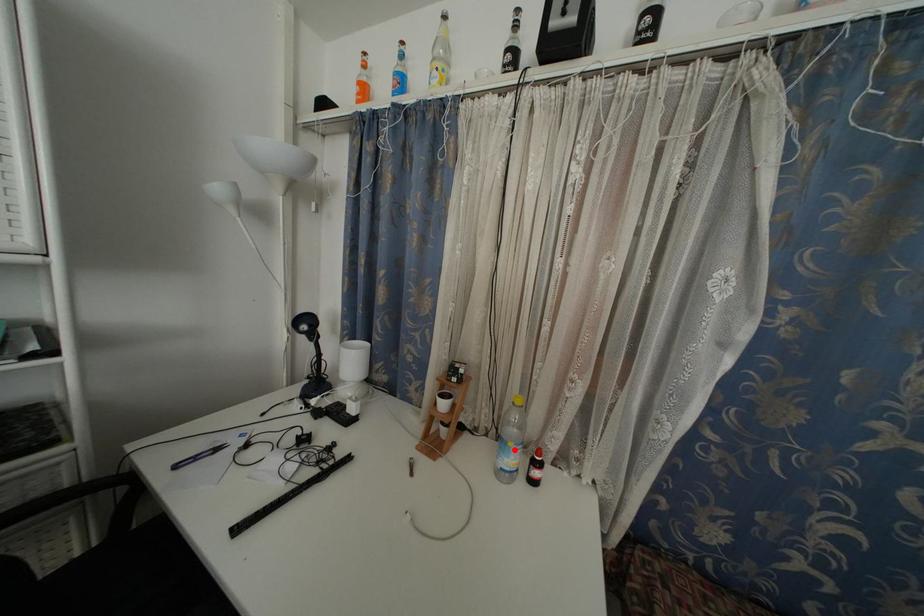
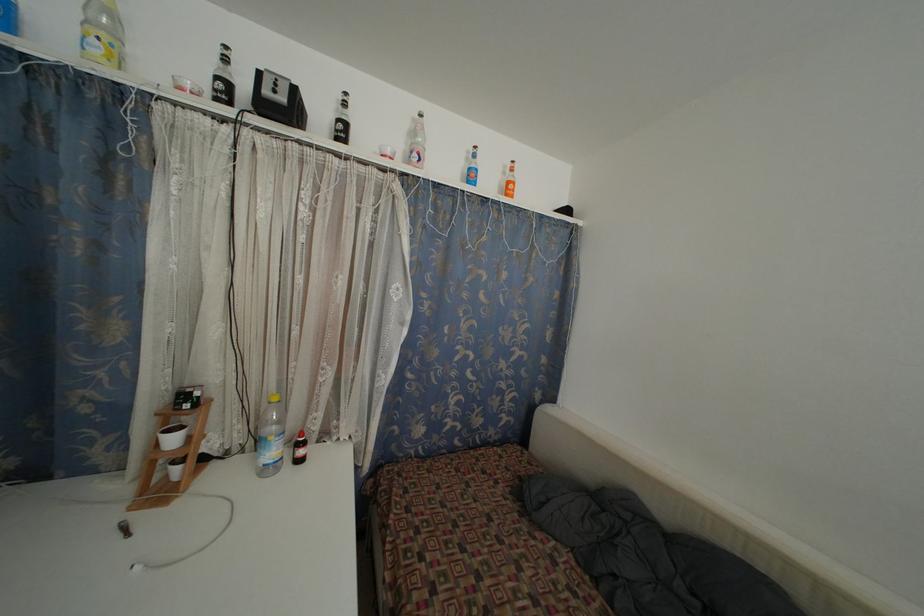
Locate, in the second image, the point that corresponds to the highlighted location in the first image.

(274, 444)